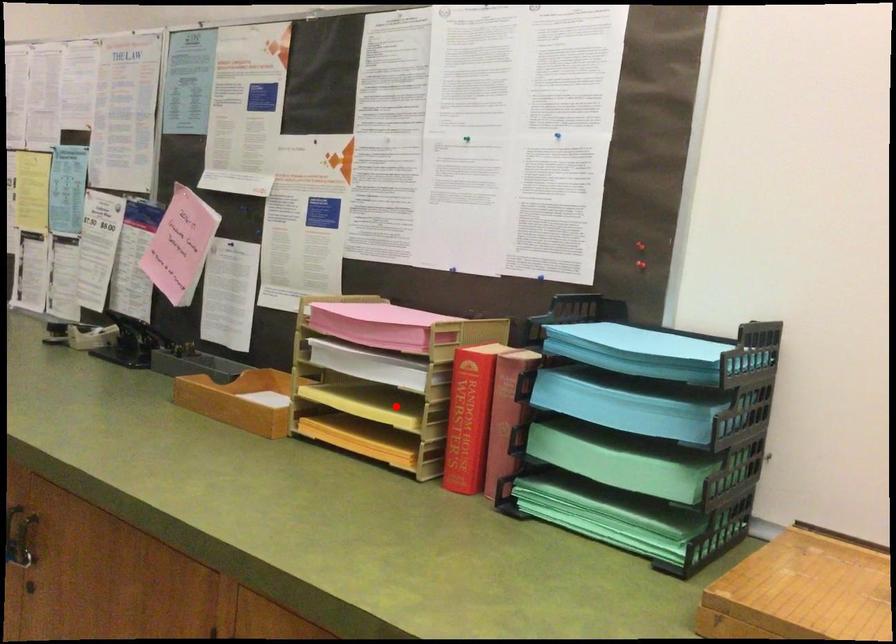
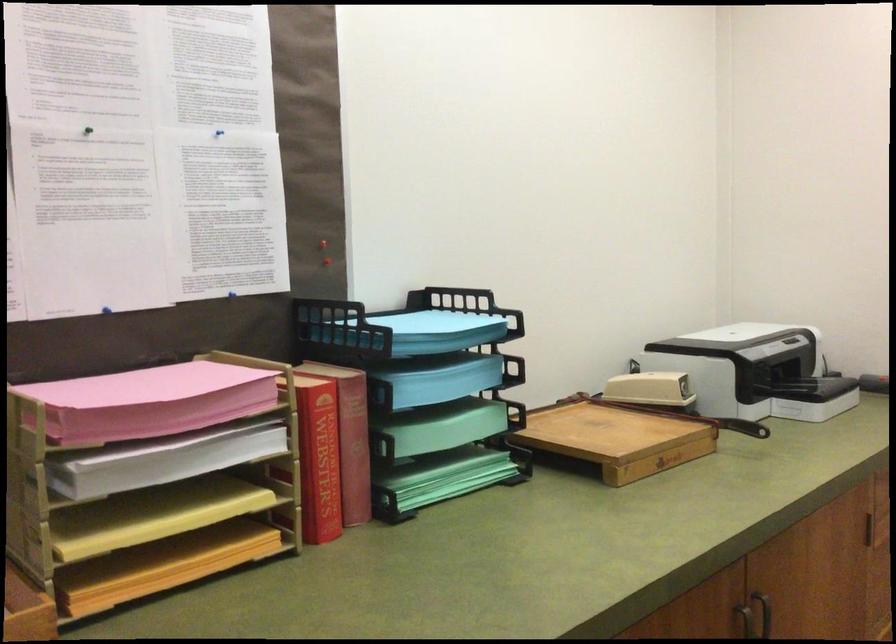
The point at the highlighted location is marked in the first image. Where is the corresponding point in the second image?

(151, 515)